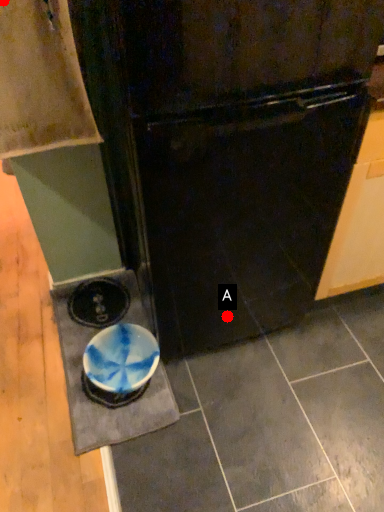
Question: Two points are circled on the image, labeled by A and B beside each circle. Which of the following is the farthest from the observer?

Choices:
 (A) A is further
 (B) B is further

Answer: (A)